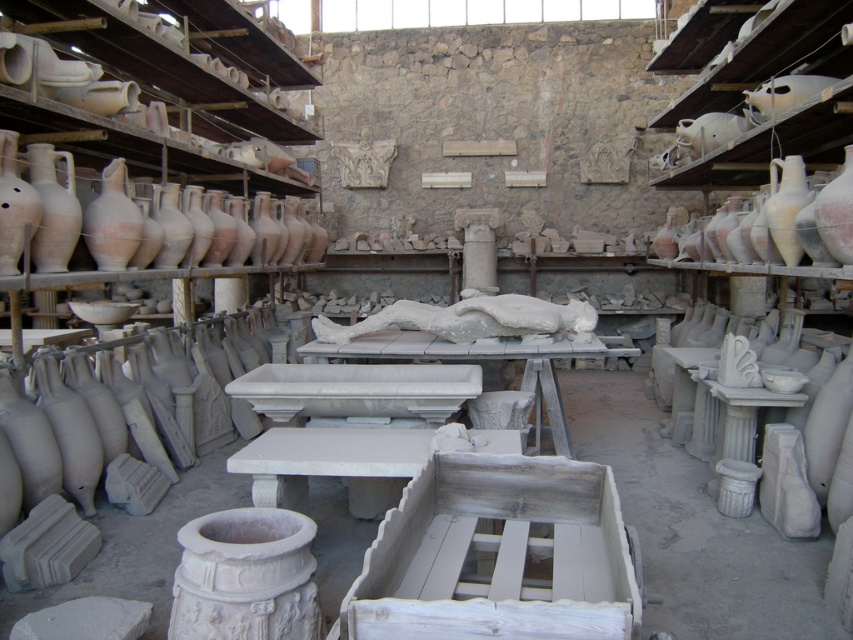
Based on the photo, can you confirm if matte white amphora at right is wider than matte clay vase at left?

Yes, matte white amphora at right is wider than matte clay vase at left.

In the scene shown: Who is positioned more to the right, matte white amphora at right or matte clay vase at left?

matte white amphora at right

Is point (769, 218) more distant than point (56, 240)?

Yes.

Find the location of a particular element. matte white amphora at right is located at coordinates (810, 211).

Does white matte amphora at upper right appear under matte clay amphora at left?

Incorrect, white matte amphora at upper right is not positioned below matte clay amphora at left.

Who is positioned more to the left, white matte amphora at upper right or matte clay amphora at left?

Positioned to the left is matte clay amphora at left.

Is point (749, 60) less distant than point (25, 193)?

No.

At what (x,y) coordinates should I click in order to perform the action: click on white matte amphora at upper right. Please return your answer as a coordinate pair (x, y). The width and height of the screenshot is (853, 640). Looking at the image, I should click on (762, 83).

Can you confirm if matte clay amphora at left is positioned below white matte sculpture at center?

No.

Who is shorter, matte clay amphora at left or white matte sculpture at center?

Standing shorter between the two is white matte sculpture at center.

Identify the location of matte clay amphora at left. The image size is (853, 640). (62, 212).

Find the location of a particular element. Image resolution: width=853 pixels, height=640 pixels. matte clay amphora at left is located at coordinates (62, 212).